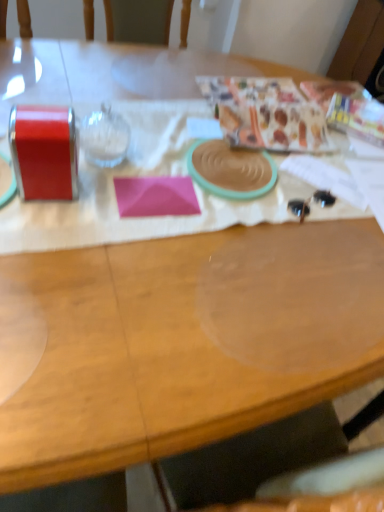
Question: Is pink matte paper at center completely or partially outside of patterned paper at upper right, marked as the first wrapping paper in a right-to-left arrangement?

Choices:
 (A) yes
 (B) no

Answer: (A)

Question: Does pink matte paper at center have a lesser height compared to patterned paper at upper right, which is counted as the 2th wrapping paper, starting from the left?

Choices:
 (A) no
 (B) yes

Answer: (A)

Question: Does pink matte paper at center appear on the left side of patterned paper at upper right, which is counted as the 2th wrapping paper, starting from the left?

Choices:
 (A) no
 (B) yes

Answer: (B)

Question: Can you confirm if pink matte paper at center is thinner than patterned paper at upper right, which is counted as the 2th wrapping paper, starting from the left?

Choices:
 (A) no
 (B) yes

Answer: (B)

Question: From the image's perspective, is pink matte paper at center on patterned paper at upper right, which is counted as the 2th wrapping paper, starting from the left?

Choices:
 (A) yes
 (B) no

Answer: (B)

Question: Is pink matte paper at center positioned with its back to patterned paper at upper right, which is counted as the 2th wrapping paper, starting from the left?

Choices:
 (A) yes
 (B) no

Answer: (B)

Question: Is matte plastic bag at upper right, arranged as the 1th wrapping paper when viewed from the left, taller than patterned paper at upper right, marked as the first wrapping paper in a right-to-left arrangement?

Choices:
 (A) no
 (B) yes

Answer: (B)

Question: Is matte plastic bag at upper right, arranged as the 2th wrapping paper when viewed from the right, not near patterned paper at upper right, marked as the first wrapping paper in a right-to-left arrangement?

Choices:
 (A) yes
 (B) no

Answer: (B)

Question: Is matte plastic bag at upper right, arranged as the 2th wrapping paper when viewed from the right, further to camera compared to patterned paper at upper right, marked as the first wrapping paper in a right-to-left arrangement?

Choices:
 (A) no
 (B) yes

Answer: (A)

Question: Can we say matte plastic bag at upper right, arranged as the 2th wrapping paper when viewed from the right, lies outside patterned paper at upper right, marked as the first wrapping paper in a right-to-left arrangement?

Choices:
 (A) no
 (B) yes

Answer: (B)

Question: Is matte plastic bag at upper right, arranged as the 2th wrapping paper when viewed from the right, shorter than patterned paper at upper right, which is counted as the 2th wrapping paper, starting from the left?

Choices:
 (A) no
 (B) yes

Answer: (A)

Question: Is matte plastic bag at upper right, arranged as the 2th wrapping paper when viewed from the right, turned away from patterned paper at upper right, which is counted as the 2th wrapping paper, starting from the left?

Choices:
 (A) yes
 (B) no

Answer: (A)

Question: Would you say patterned paper at upper right, which is counted as the 2th wrapping paper, starting from the left, contains matte plastic bag at upper right, arranged as the 1th wrapping paper when viewed from the left?

Choices:
 (A) no
 (B) yes

Answer: (A)